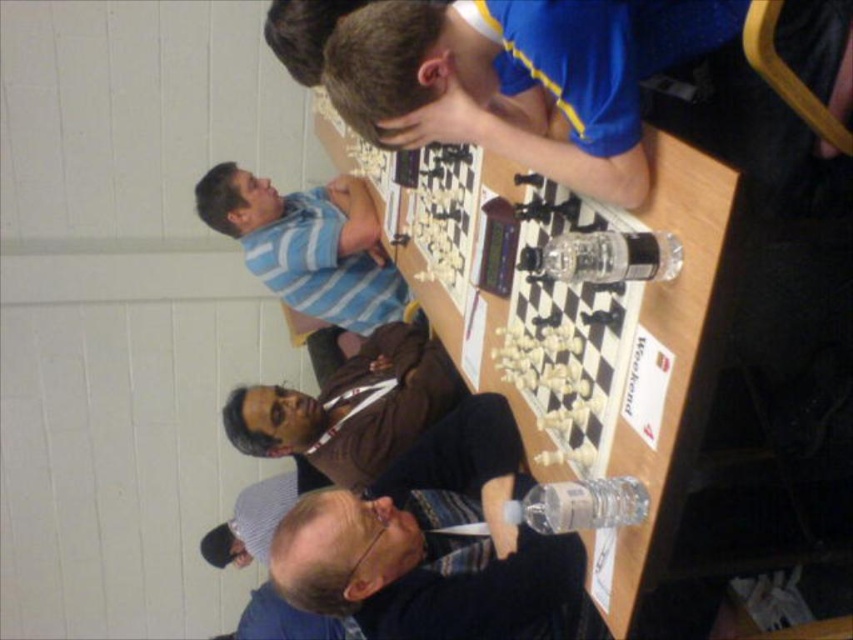
Question: Is blue jersey at upper center below brown leather jacket at center?

Choices:
 (A) yes
 (B) no

Answer: (B)

Question: Among these points, which one is nearest to the camera?

Choices:
 (A) (317, 460)
 (B) (737, 4)
 (C) (399, 561)
 (D) (370, 221)

Answer: (B)

Question: Which point is closer to the camera taking this photo?

Choices:
 (A) coord(281,518)
 (B) coord(360,218)

Answer: (B)

Question: Is brown leather jacket at center closer to the viewer compared to blue striped shirt at upper left?

Choices:
 (A) yes
 (B) no

Answer: (A)

Question: Does brown leather jacket at center appear over blue striped shirt at upper left?

Choices:
 (A) no
 (B) yes

Answer: (A)

Question: Which object is the farthest from the blue striped shirt at upper left?

Choices:
 (A) brown leather jacket at center
 (B) blue jersey at upper center
 (C) striped fabric shirt at lower center

Answer: (B)